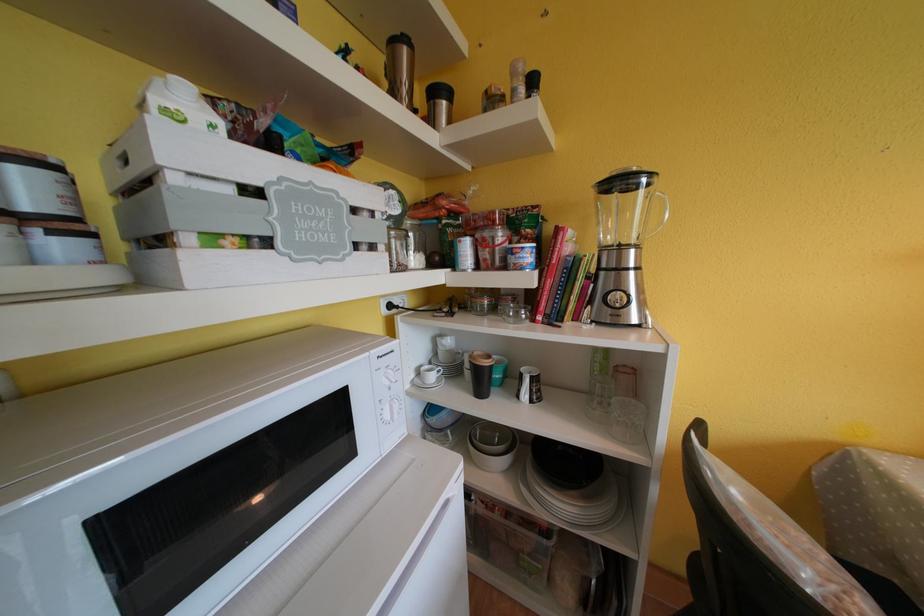
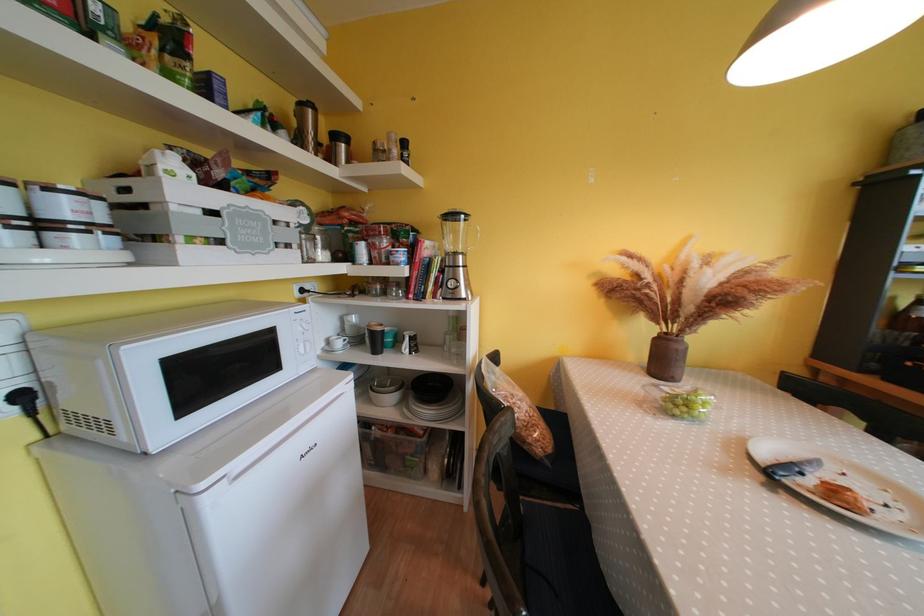
Locate, in the second image, the point that corresponds to the point at 394,421 in the first image.

(309, 355)